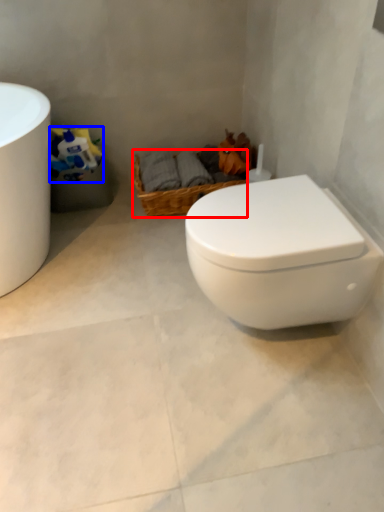
Question: Among these objects, which one is farthest to the camera, basket (highlighted by a red box) or toilet paper (highlighted by a blue box)?

Choices:
 (A) basket
 (B) toilet paper

Answer: (A)